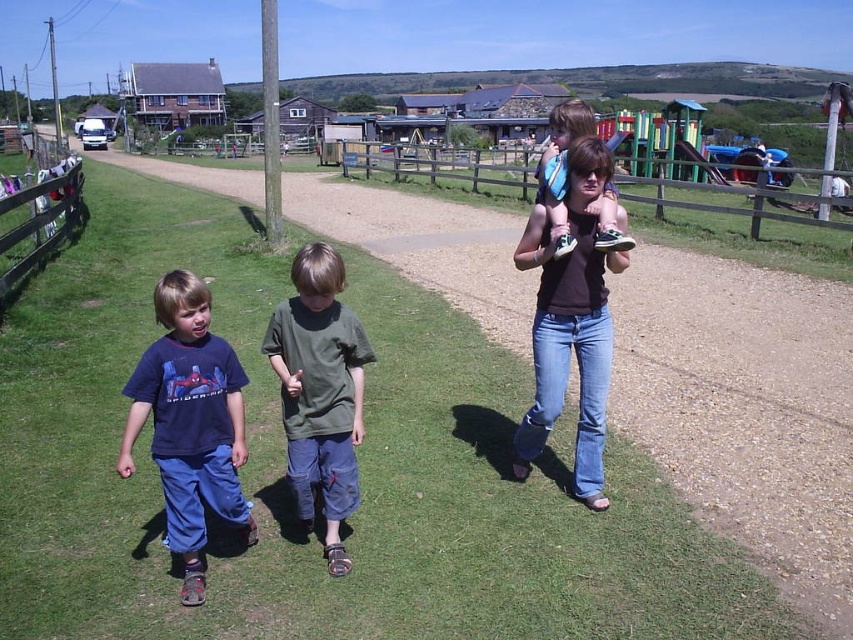
Question: Can you confirm if green cotton shirt at center is smaller than wooden fence at center?

Choices:
 (A) no
 (B) yes

Answer: (B)

Question: Which point is closer to the camera?

Choices:
 (A) dark blue t-shirt at center
 (B) wooden fence at left
 (C) green cotton shirt at center

Answer: (A)

Question: Is dark blue t-shirt at center wider than matte blue sneakers at center?

Choices:
 (A) no
 (B) yes

Answer: (A)

Question: Does green cotton shirt at center appear over wooden fence at center?

Choices:
 (A) no
 (B) yes

Answer: (A)

Question: Considering the real-world distances, which object is closest to the matte blue sneakers at center?

Choices:
 (A) dark blue t-shirt at center
 (B) matte brown shirt at center

Answer: (B)

Question: Estimate the real-world distances between objects in this image. Which object is closer to the green cotton shirt at center?

Choices:
 (A) wooden fence at left
 (B) matte brown shirt at center
 (C) wooden fence at center
 (D) matte blue sneakers at center

Answer: (B)